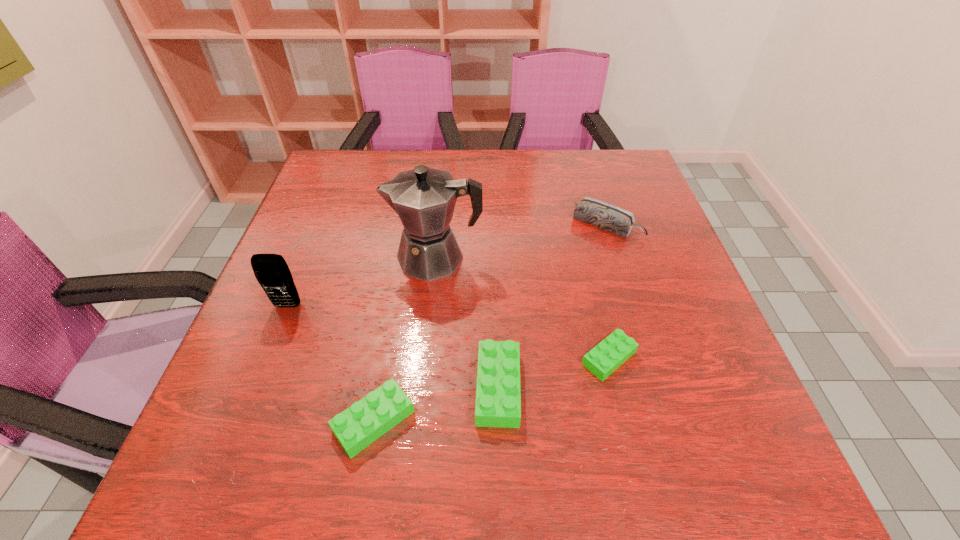
In the image, there is a desktop. Where is `blank space at the near edge`? Image resolution: width=960 pixels, height=540 pixels. blank space at the near edge is located at coordinates (315, 385).

This screenshot has height=540, width=960. In the image, there is a desktop. Find the location of `vacant space at the left edge`. vacant space at the left edge is located at coordinates (313, 206).

You are a GUI agent. You are given a task and a screenshot of the screen. Output one action in this format:
    pyautogui.click(x=<x>, y=<y>)
    Task: Click on the blank area at the right edge
    The image size is (960, 540).
    Given the screenshot: What is the action you would take?
    pyautogui.click(x=661, y=312)

At what (x,y) coordinates should I click in order to perform the action: click on vacant space at the far left corner of the desktop. Please return your answer as a coordinate pair (x, y). The height and width of the screenshot is (540, 960). Looking at the image, I should click on (337, 175).

Where is `vacant area at the far right corner`? The width and height of the screenshot is (960, 540). vacant area at the far right corner is located at coordinates (635, 188).

You are a GUI agent. You are given a task and a screenshot of the screen. Output one action in this format:
    pyautogui.click(x=<x>, y=<y>)
    Task: Click on the free space between the rightmost Lego and the pencil box
    
    Given the screenshot: What is the action you would take?
    pyautogui.click(x=608, y=291)

In order to click on vacant space that's between the fifth tallest object and the leftmost object in this screenshot , I will do `click(331, 363)`.

Where is `vacant area that lies between the tallest object and the second Lego from right to left`? This screenshot has height=540, width=960. vacant area that lies between the tallest object and the second Lego from right to left is located at coordinates (467, 322).

Image resolution: width=960 pixels, height=540 pixels. What are the coordinates of `empty space between the pencil box and the shortest Lego` in the screenshot? It's located at (608, 291).

Locate an element on the screen. This screenshot has height=540, width=960. free space between the rightmost Lego and the tallest Lego is located at coordinates (553, 373).